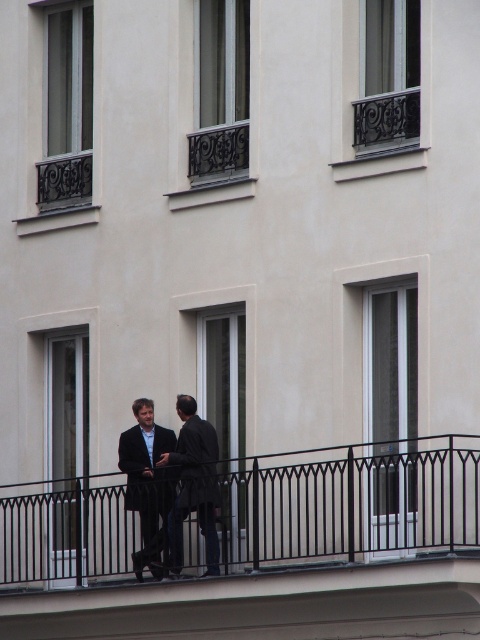
You are a tailor who needs to determine which clothing item takes up more space horizontally. Based on the scene, which one is wider between the dark gray wool jacket at center and the dark blue wool suit at center?

The dark blue wool suit at center is wider than the dark gray wool jacket at center.